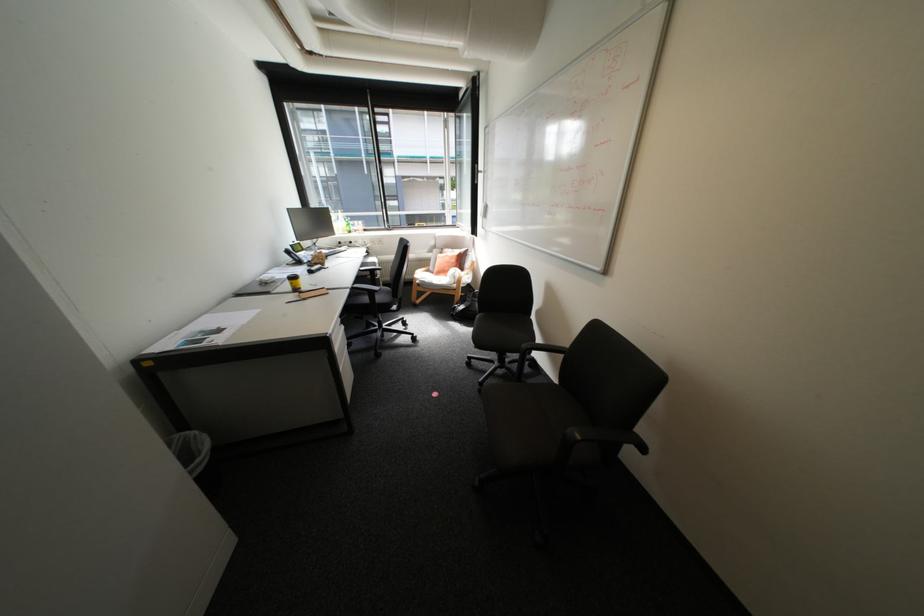
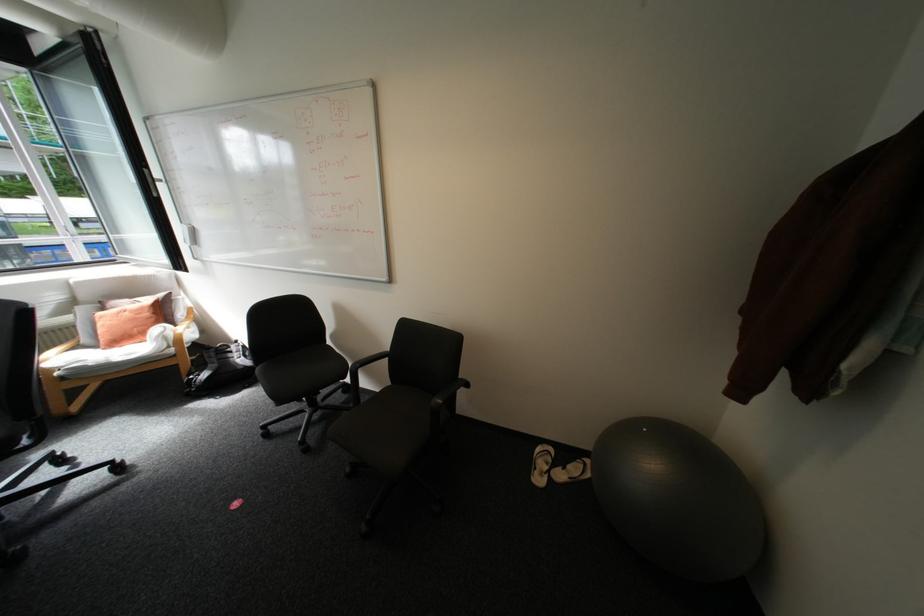
Question: Based on the continuous images, in which direction is the camera rotating? Reply with the corresponding letter.

Choices:
 (A) Left
 (B) Right
 (C) Up
 (D) Down

Answer: (B)